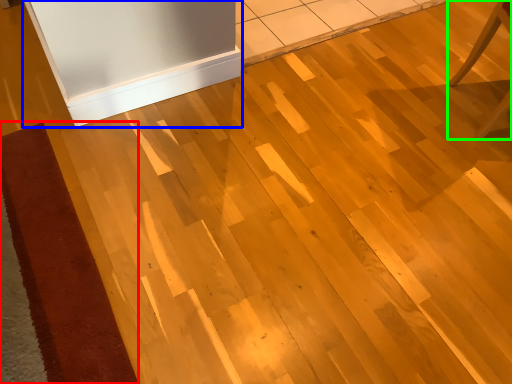
Question: Considering the real-world distances, which object is closest to doormat (highlighted by a red box)? fridge (highlighted by a blue box) or furniture (highlighted by a green box).

Choices:
 (A) fridge
 (B) furniture

Answer: (A)